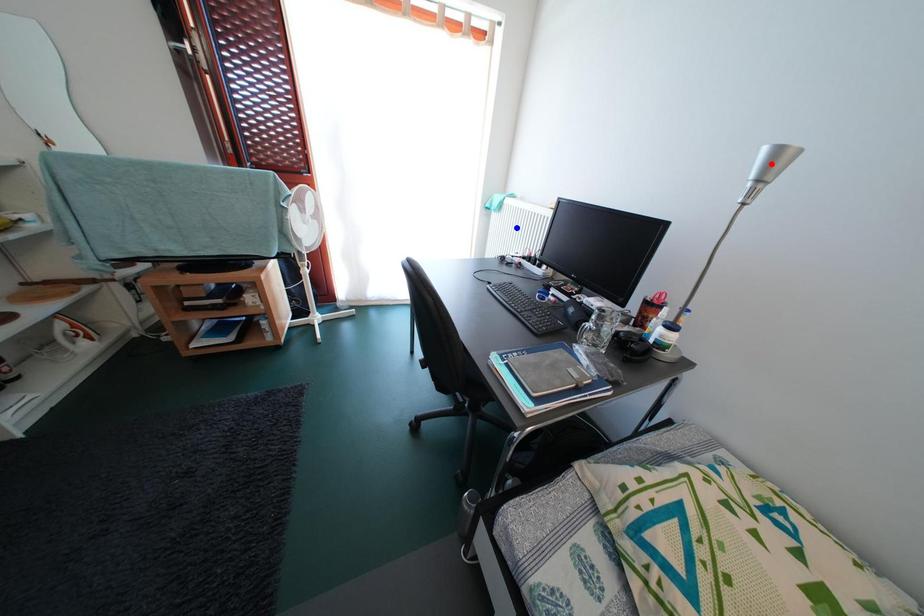
Question: In the image, two points are highlighted. Which point is nearer to the camera? Reply with the corresponding letter.

Choices:
 (A) blue point
 (B) red point

Answer: (B)